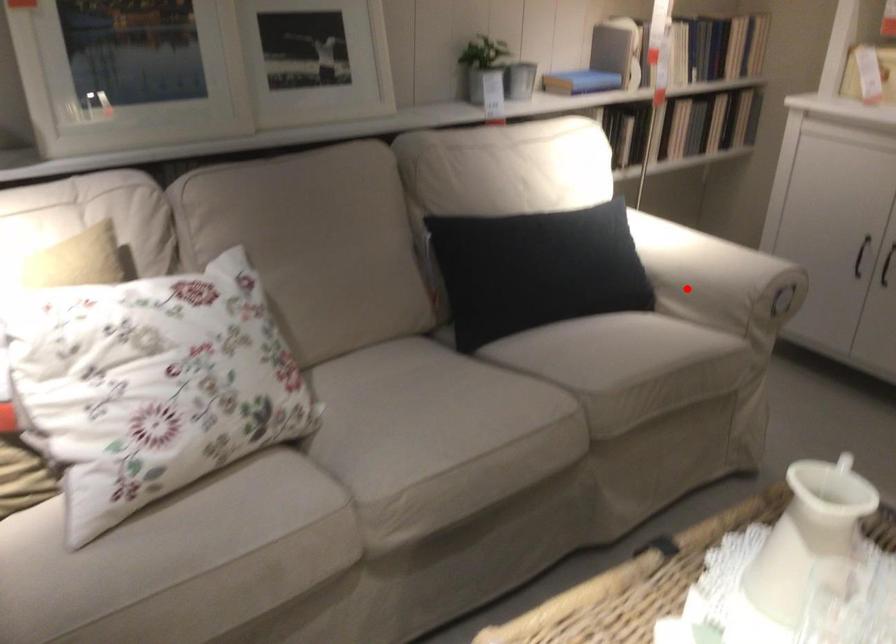
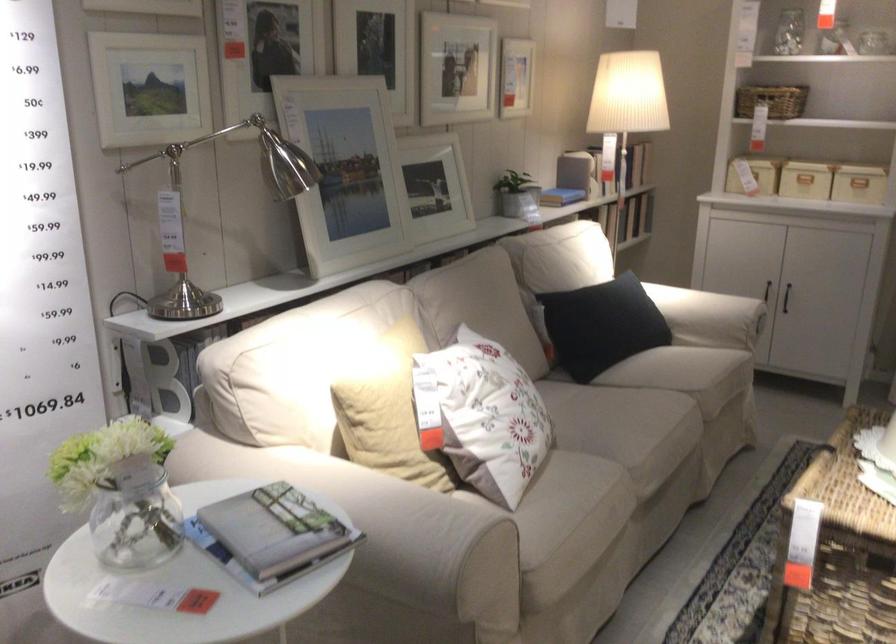
Question: I am providing you with two images of the same scene from different viewpoints. A red point is shown in image1. For the corresponding object point in image2, is it positioned nearer or farther from the camera?

Choices:
 (A) Nearer
 (B) Farther

Answer: (B)